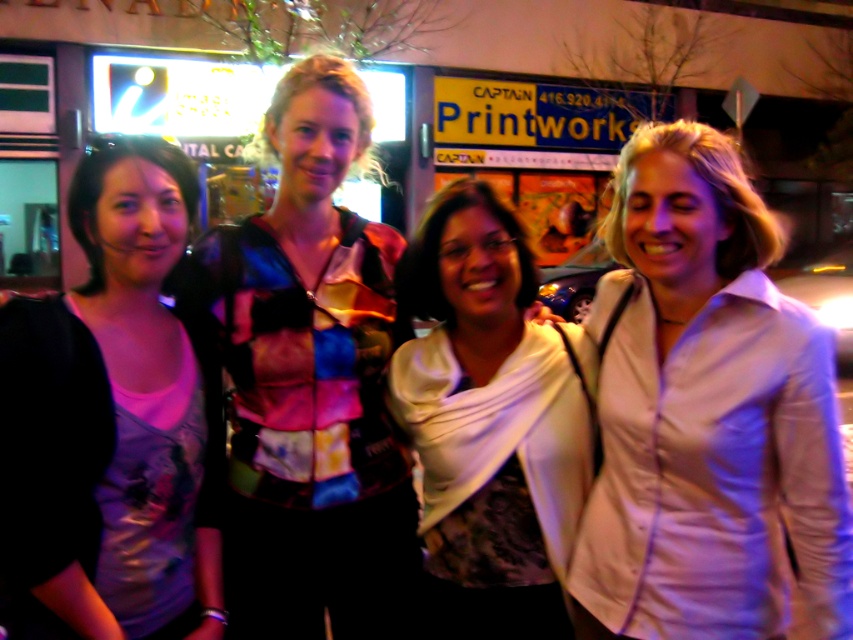
Which is behind, point (308, 428) or point (503, 209)?

Point (503, 209)

Does point (347, 333) come behind point (535, 488)?

Yes.

Is point (264, 529) positioned behind point (445, 212)?

That is False.

This screenshot has width=853, height=640. I want to click on multicolored patchwork shirt at center, so click(x=309, y=381).

Does white satin blouse at right lie behind matte black shirt at left?

Yes, it is.

This screenshot has width=853, height=640. What do you see at coordinates (706, 417) in the screenshot?
I see `white satin blouse at right` at bounding box center [706, 417].

This screenshot has height=640, width=853. I want to click on white satin blouse at right, so coord(706,417).

Is the position of white satin blouse at right less distant than that of white satin scarf at center?

Yes, white satin blouse at right is in front of white satin scarf at center.

Can you confirm if white satin blouse at right is taller than white satin scarf at center?

Indeed, white satin blouse at right has a greater height compared to white satin scarf at center.

Is point (730, 477) positioned behind point (463, 433)?

No, (730, 477) is in front of (463, 433).

You are a GUI agent. You are given a task and a screenshot of the screen. Output one action in this format:
    pyautogui.click(x=<x>, y=<y>)
    Task: Click on the white satin blouse at right
    
    Given the screenshot: What is the action you would take?
    pos(706,417)